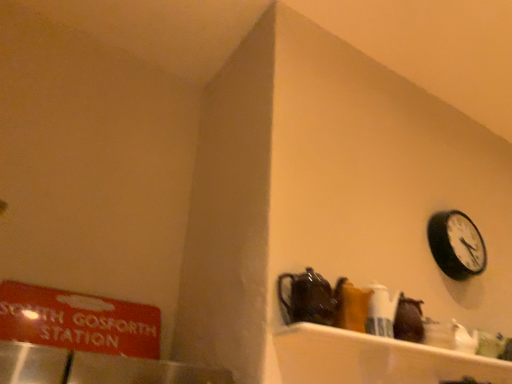
Question: Is there a large distance between shiny dark brown teapot at center and red matte sign at left?

Choices:
 (A) yes
 (B) no

Answer: (B)

Question: Can you confirm if shiny dark brown teapot at center is taller than red matte sign at left?

Choices:
 (A) no
 (B) yes

Answer: (A)

Question: From a real-world perspective, is shiny dark brown teapot at center below red matte sign at left?

Choices:
 (A) no
 (B) yes

Answer: (A)

Question: Is shiny dark brown teapot at center positioned with its back to red matte sign at left?

Choices:
 (A) yes
 (B) no

Answer: (B)

Question: Is shiny dark brown teapot at center not inside red matte sign at left?

Choices:
 (A) yes
 (B) no

Answer: (A)

Question: In terms of height, does black matte wall clock at upper right look taller or shorter compared to shiny dark brown teapot at center?

Choices:
 (A) short
 (B) tall

Answer: (B)

Question: Is black matte wall clock at upper right bigger or smaller than shiny dark brown teapot at center?

Choices:
 (A) small
 (B) big

Answer: (B)

Question: Based on their positions, is black matte wall clock at upper right located to the left or right of shiny dark brown teapot at center?

Choices:
 (A) right
 (B) left

Answer: (A)

Question: Does point (454, 213) appear closer or farther from the camera than point (294, 317)?

Choices:
 (A) closer
 (B) farther

Answer: (B)

Question: From the image's perspective, is shiny dark brown teapot at center located above or below black matte wall clock at upper right?

Choices:
 (A) below
 (B) above

Answer: (A)

Question: Considering the positions of point (308, 266) and point (478, 266), is point (308, 266) closer or farther from the camera than point (478, 266)?

Choices:
 (A) farther
 (B) closer

Answer: (B)

Question: From a real-world perspective, is shiny dark brown teapot at center physically located above or below black matte wall clock at upper right?

Choices:
 (A) above
 (B) below

Answer: (B)

Question: Is shiny dark brown teapot at center spatially inside black matte wall clock at upper right, or outside of it?

Choices:
 (A) outside
 (B) inside

Answer: (A)

Question: Is black matte wall clock at upper right inside the boundaries of red matte sign at left, or outside?

Choices:
 (A) inside
 (B) outside

Answer: (B)

Question: From a real-world perspective, is black matte wall clock at upper right physically located above or below red matte sign at left?

Choices:
 (A) above
 (B) below

Answer: (A)